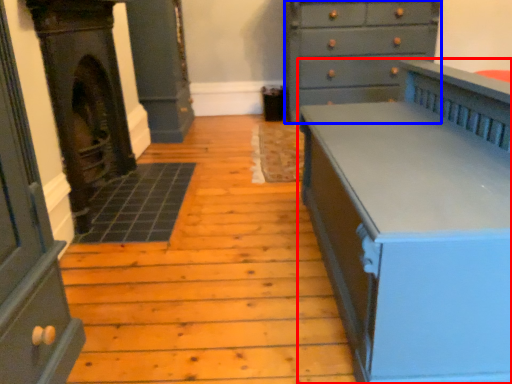
Question: Which point is further to the camera, chest of drawers (highlighted by a red box) or chest of drawers (highlighted by a blue box)?

Choices:
 (A) chest of drawers
 (B) chest of drawers

Answer: (B)